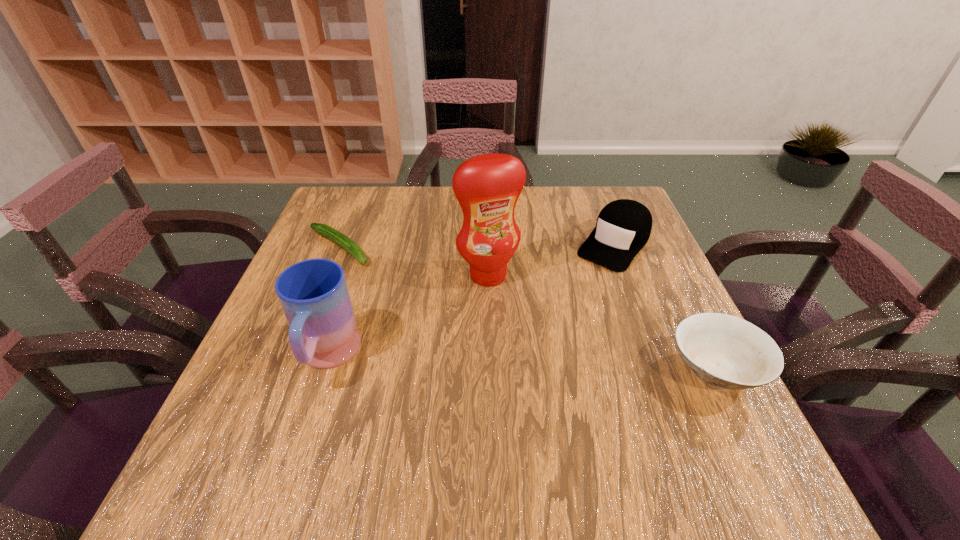
Where is `vacant region located on the front-facing side of the shortest object`? Image resolution: width=960 pixels, height=540 pixels. vacant region located on the front-facing side of the shortest object is located at coordinates (449, 326).

This screenshot has height=540, width=960. I want to click on vacant region located 0.090m on the label side of the tallest object, so [x=512, y=315].

Where is `blank area located 0.100m on the label side of the tallest object`? The width and height of the screenshot is (960, 540). blank area located 0.100m on the label side of the tallest object is located at coordinates (513, 319).

Image resolution: width=960 pixels, height=540 pixels. Find the location of `blank area located 0.380m on the label side of the tallest object`. blank area located 0.380m on the label side of the tallest object is located at coordinates (570, 433).

In order to click on vacant space located on the front-facing side of the cap in this screenshot , I will do `click(577, 292)`.

Locate an element on the screen. This screenshot has width=960, height=540. vacant space located 0.120m on the front-facing side of the cap is located at coordinates (575, 294).

Identify the location of free spot located on the front-facing side of the cap. (586, 282).

Identify the location of zucchini located in the far edge section of the desktop. This screenshot has width=960, height=540. (340, 239).

At what (x,y) coordinates should I click in order to perform the action: click on cap situated at the far edge. Please return your answer as a coordinate pair (x, y). The image size is (960, 540). Looking at the image, I should click on (623, 227).

Identify the location of mug positioned at the near edge. The height and width of the screenshot is (540, 960). (313, 293).